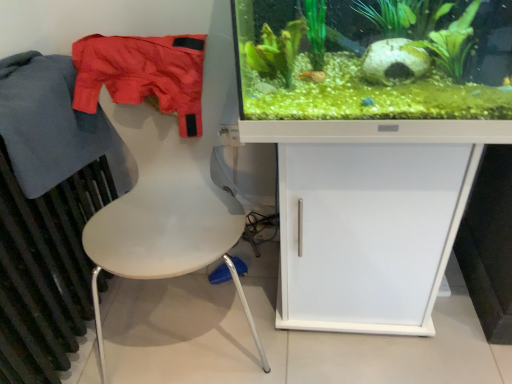
At what (x,y) coordinates should I click in order to perform the action: click on free space that is in between white matte chair at left and white matte cabinet at center. Please return your answer as a coordinate pair (x, y). This screenshot has height=384, width=512. Looking at the image, I should click on (311, 331).